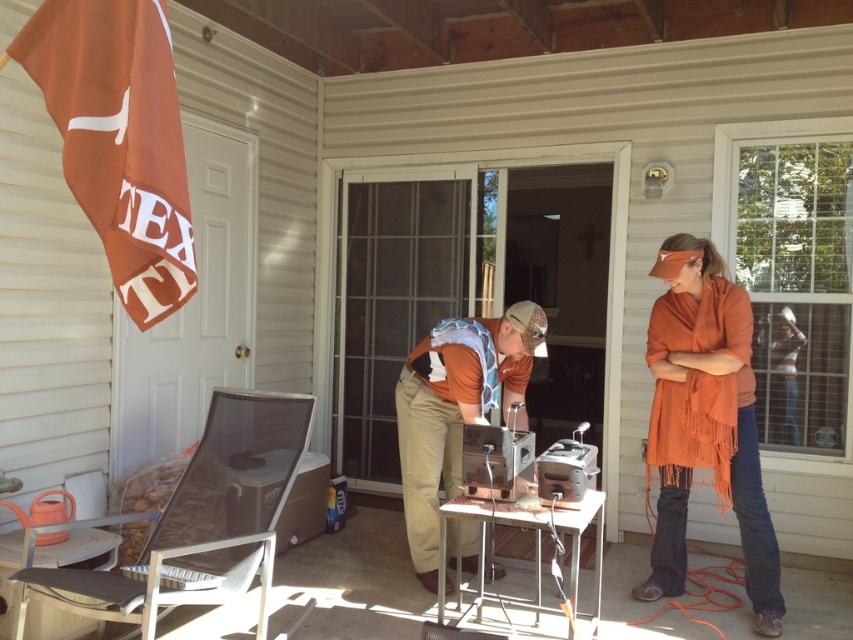
Between point (756, 621) and point (573, 499), which one is positioned behind?

The point (756, 621) is more distant.

Is orange fringed scarf at right positioned in front of satin silver toaster at center?

No, orange fringed scarf at right is further to the viewer.

Locate an element on the screen. This screenshot has width=853, height=640. orange fringed scarf at right is located at coordinates (705, 420).

From the picture: Does orange fringed scarf at right have a larger size compared to orange fabric at center?

Actually, orange fringed scarf at right might be smaller than orange fabric at center.

Image resolution: width=853 pixels, height=640 pixels. What are the coordinates of `orange fringed scarf at right` in the screenshot? It's located at (705, 420).

Between orange fabric at center and satin silver toaster at center, which one has more height?

orange fabric at center is taller.

Consider the image. Who is more distant from viewer, (433, 428) or (566, 448)?

The point (433, 428) is behind.

The image size is (853, 640). Find the location of `orange fabric at center`. orange fabric at center is located at coordinates point(456,410).